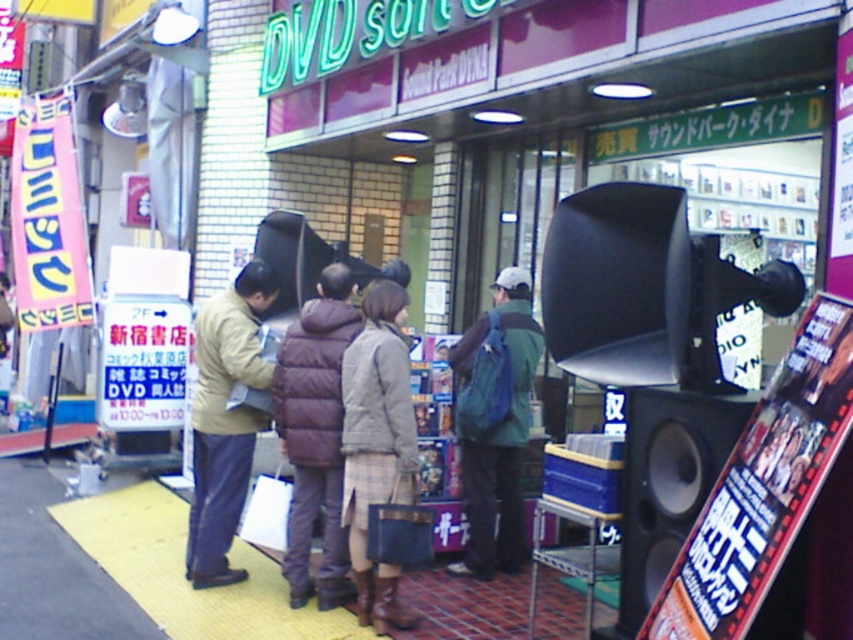
Question: Which of these objects is positioned farthest from the light brown leather jacket at center?

Choices:
 (A) light brown fabric coat at center
 (B) dark brown puffy coat at center

Answer: (A)

Question: Can you confirm if black matte speaker at right is positioned to the right of light brown leather jacket at center?

Choices:
 (A) no
 (B) yes

Answer: (B)

Question: Which point is closer to the camera taking this photo?

Choices:
 (A) (500, 538)
 (B) (227, 577)
 (C) (323, 561)

Answer: (C)

Question: Is dark brown puffy coat at center wider than light brown leather jacket at center?

Choices:
 (A) yes
 (B) no

Answer: (B)

Question: Which of the following is the farthest from the observer?

Choices:
 (A) light brown leather jacket at center
 (B) green fabric backpack at center

Answer: (B)

Question: In this image, where is black matte speaker at right located relative to green fabric backpack at center?

Choices:
 (A) below
 (B) above

Answer: (A)